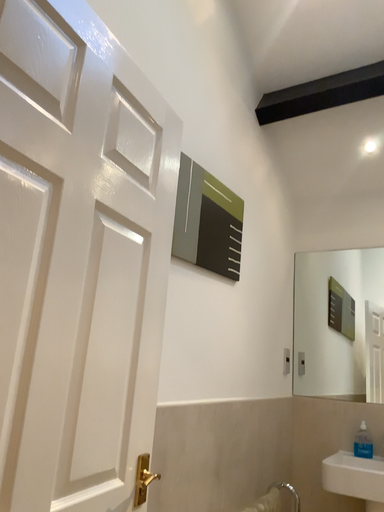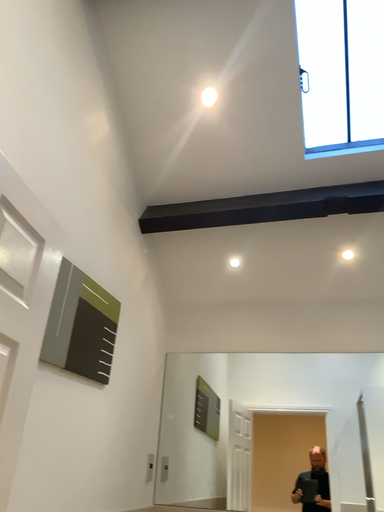
Question: Which way did the camera rotate in the video?

Choices:
 (A) rotated right
 (B) rotated left

Answer: (A)